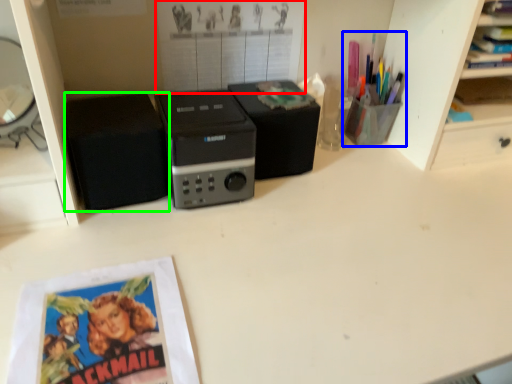
Question: Which object is the farthest from poster page (highlighted by a red box)? Choose among these: stationery (highlighted by a blue box) or speaker (highlighted by a green box).

Choices:
 (A) stationery
 (B) speaker

Answer: (A)